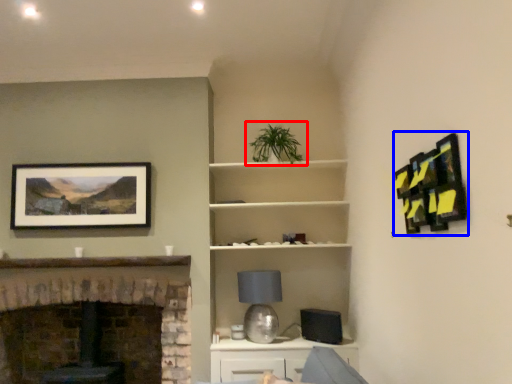
Question: Which object appears closest to the camera in this image, houseplant (highlighted by a red box) or picture frame (highlighted by a blue box)?

Choices:
 (A) houseplant
 (B) picture frame

Answer: (B)